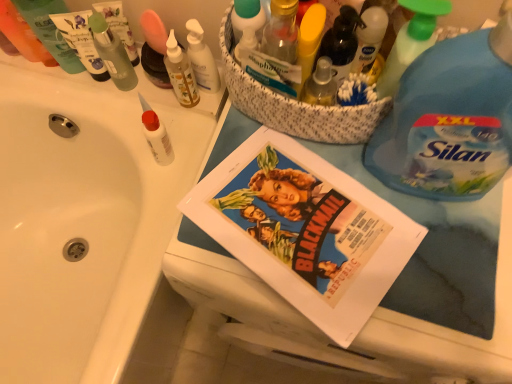
This screenshot has height=384, width=512. What are the coordinates of `vacant space to the left of translucent plastic pump bottle at upper center, positioned as the 3th toiletry in right-to-left order` in the screenshot? It's located at (124, 112).